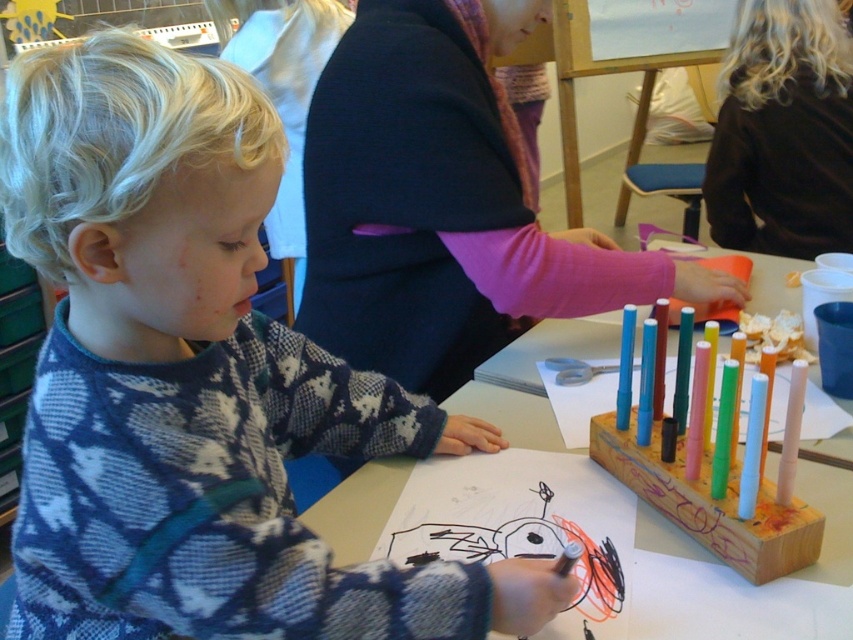
Question: Considering the real-world distances, which object is closest to the dark blue fabric at center?

Choices:
 (A) black fabric at upper right
 (B) wooden at center

Answer: (B)

Question: Does knitted sweater at center have a smaller size compared to dark blue fabric at center?

Choices:
 (A) no
 (B) yes

Answer: (B)

Question: Among these points, which one is nearest to the camera?

Choices:
 (A) (380, 506)
 (B) (334, 224)

Answer: (A)

Question: From the image, what is the correct spatial relationship of knitted sweater at center in relation to wooden at center?

Choices:
 (A) above
 (B) below

Answer: (A)

Question: Which point appears closest to the camera in this image?

Choices:
 (A) [x=846, y=540]
 (B) [x=466, y=268]

Answer: (A)

Question: Can you confirm if dark blue fabric at center is wider than wooden at center?

Choices:
 (A) yes
 (B) no

Answer: (B)